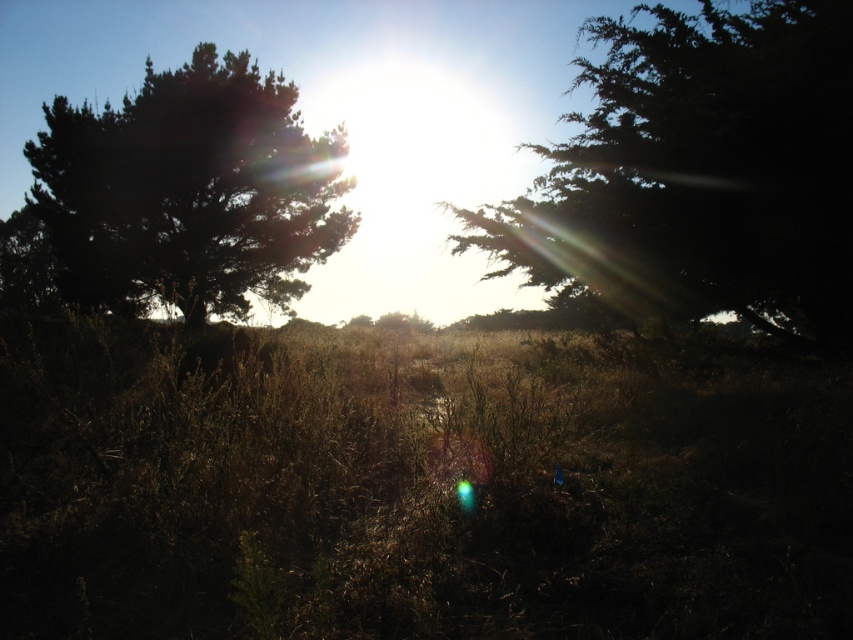
You are standing in the serene outdoor scene with the sun near the center. You see two points marked in the image. The first point is at coordinates point (676,282) and the second is at point (293,141). Which point is closer to you?

Point (676,282) is in front of point (293,141), so the first point is closer to you.

You are a photographer trying to capture the sunset scene. You want to frame the dark green textured tree at upper right and the dark green textured tree at left in your shot. Which tree should you focus on if you want to emphasize the height difference between them?

You should focus on the dark green textured tree at upper right because it has a greater height compared to the dark green textured tree at left, making the height difference more noticeable in the photograph.